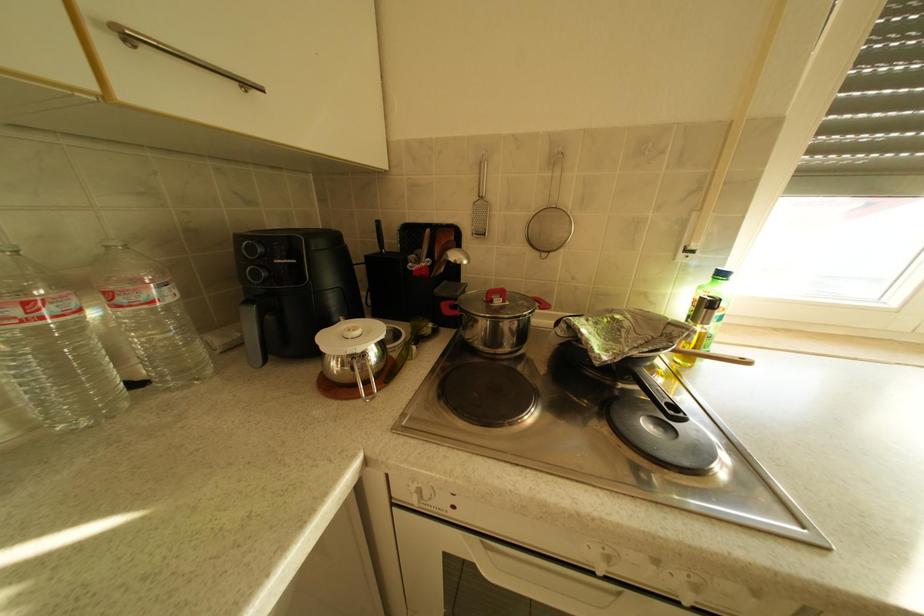
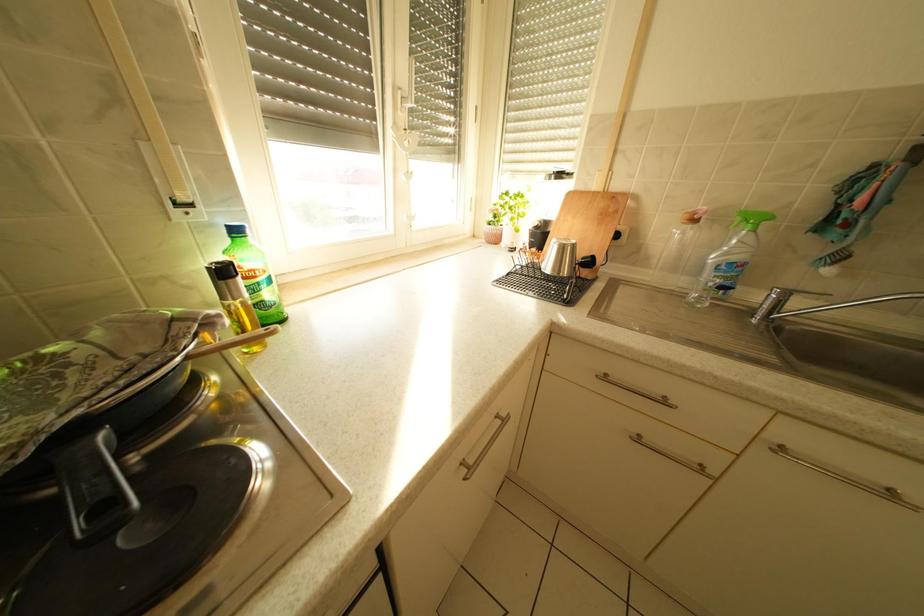
The first image is from the beginning of the video and the second image is from the end. How did the camera likely rotate when shooting the video?

The camera rotated toward right-down.